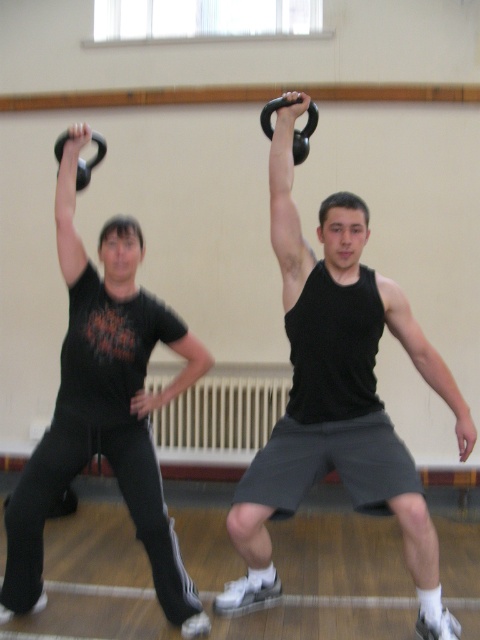
You are a fitness instructor observing the kettlebell workout session. You need to adjust the lighting to focus on the person wearing the black matte tank top at upper center. Which coordinate should you aim the spotlight at?

The black matte tank top at upper center is located at point (x=337, y=396), so you should aim the spotlight at those coordinates to focus on the individual.

Based on the photo, you are a photographer setting up a shot of the two individuals working out. You want to ensure that both the black matte tank top at upper center and the black rubber kettlebell at upper center are clearly visible in the frame. Considering their positions, which object should you focus on first to ensure proper depth of field?

The black matte tank top at upper center has a greater height compared to the black rubber kettlebell at upper center, so focusing on the black matte tank top at upper center first will ensure proper depth of field as it is positioned closer to the camera.

You are a fitness trainer observing the kettlebell workout. The gym floor has a coordinate system where the bottom left corner is the origin. The matte black kettlebell at upper center is at position coordinates. Can you confirm if the kettlebell is closer to the right side of the gym? Please explain your reasoning based on its coordinates.

The coordinates of the matte black kettlebell at upper center are given as point (104, 406). Since the x coordinate is 0.637, which is closer to 1 than to 0, the kettlebell is closer to the right side of the gym.